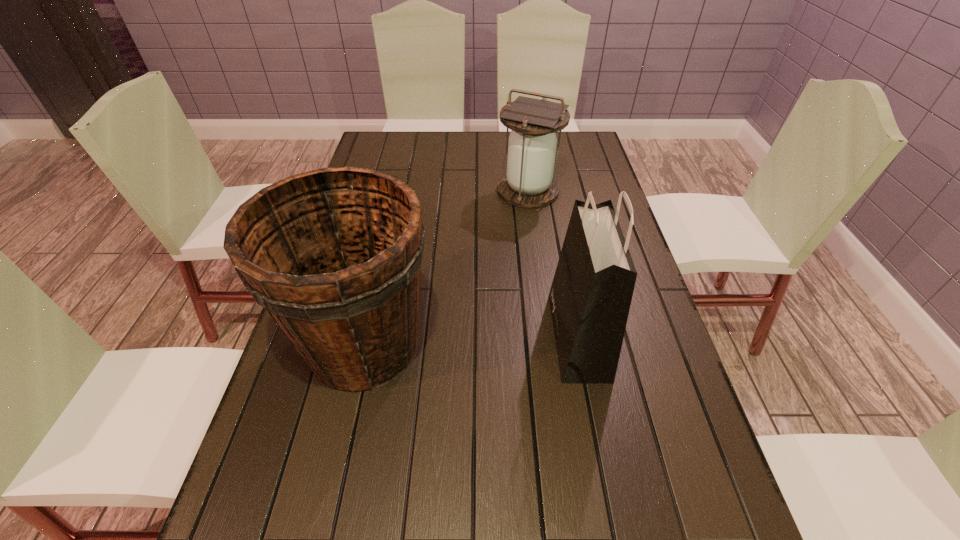
I want to click on vacant area that lies between the shopping bag and the farthest object, so click(x=553, y=263).

What are the coordinates of `object that is the second closest to the shortest object` in the screenshot? It's located at (334, 254).

Image resolution: width=960 pixels, height=540 pixels. What are the coordinates of `object that is the second nearest to the leftmost object` in the screenshot? It's located at (529, 182).